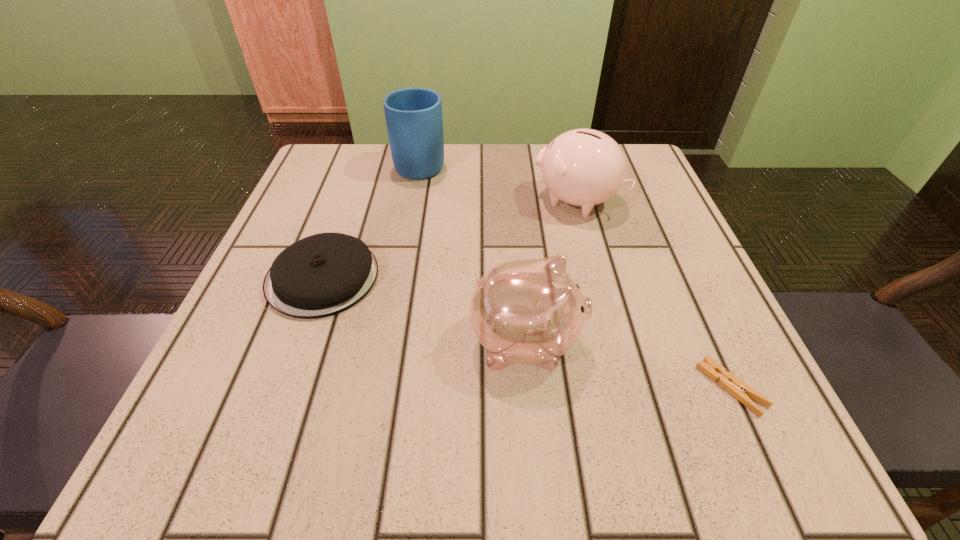
Where is `vacant area at the left edge`? vacant area at the left edge is located at coordinates (298, 398).

This screenshot has width=960, height=540. In the image, there is a desktop. Identify the location of vacant space at the right edge. (642, 359).

Image resolution: width=960 pixels, height=540 pixels. What are the coordinates of `vacant space at the far left corner of the desktop` in the screenshot? It's located at (314, 171).

At what (x,y) coordinates should I click in order to perform the action: click on vacant space at the near left corner of the desktop. Please return your answer as a coordinate pair (x, y). Looking at the image, I should click on (248, 425).

Identify the location of free space between the mug and the pancake. The width and height of the screenshot is (960, 540). (372, 220).

Locate an element on the screen. Image resolution: width=960 pixels, height=540 pixels. free spot between the rightmost object and the farther piggy bank is located at coordinates (654, 294).

Locate an element on the screen. The width and height of the screenshot is (960, 540). free spot between the mug and the farther piggy bank is located at coordinates (498, 181).

You are a GUI agent. You are given a task and a screenshot of the screen. Output one action in this format:
    pyautogui.click(x=<x>, y=<y>)
    Task: Click on the free area in between the clothespin and the farther piggy bank
    
    Given the screenshot: What is the action you would take?
    pyautogui.click(x=654, y=294)

Where is `free space between the shortest object and the mug`? This screenshot has width=960, height=540. free space between the shortest object and the mug is located at coordinates pos(576,275).

The width and height of the screenshot is (960, 540). Find the location of `vacant region between the mug and the rightmost object`. vacant region between the mug and the rightmost object is located at coordinates (576, 275).